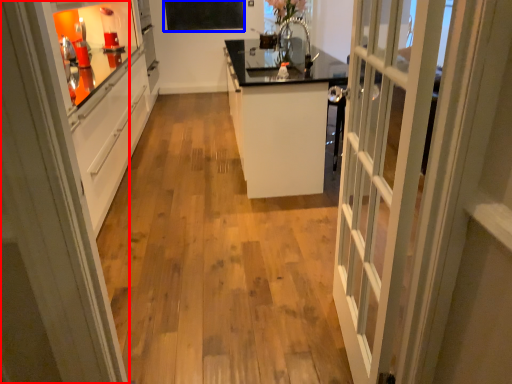
Question: Which point is further to the camera, door (highlighted by a red box) or bulletin board (highlighted by a blue box)?

Choices:
 (A) door
 (B) bulletin board

Answer: (B)